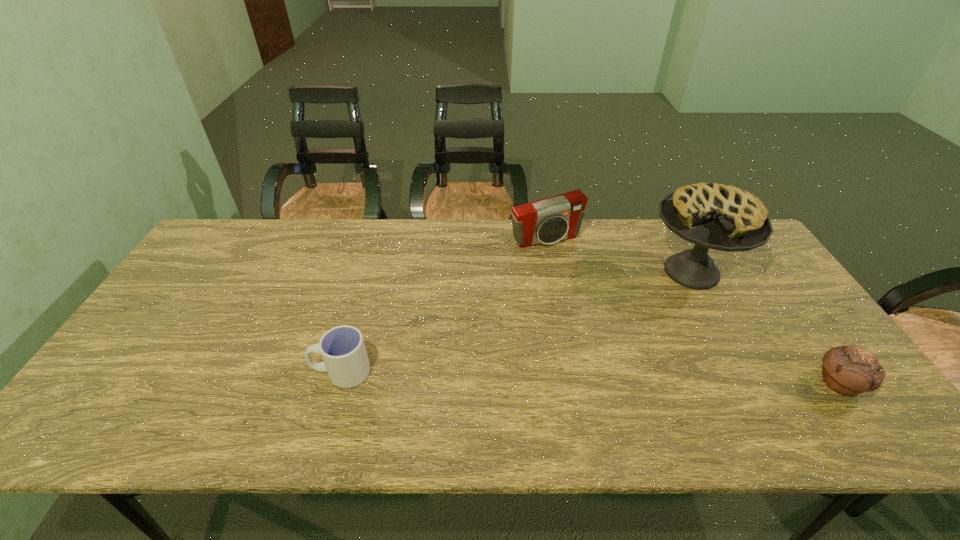
Where is `object identified as the third closest to the third shortest object`? Image resolution: width=960 pixels, height=540 pixels. object identified as the third closest to the third shortest object is located at coordinates (848, 370).

Where is `the closest object to the muffin`? The width and height of the screenshot is (960, 540). the closest object to the muffin is located at coordinates pos(714,216).

Find the location of a particular element. The height and width of the screenshot is (540, 960). free point that satisfies the following two spatial constraints: 1. on the front side of the second object from left to right; 2. on the right side of the tallest object is located at coordinates (551, 272).